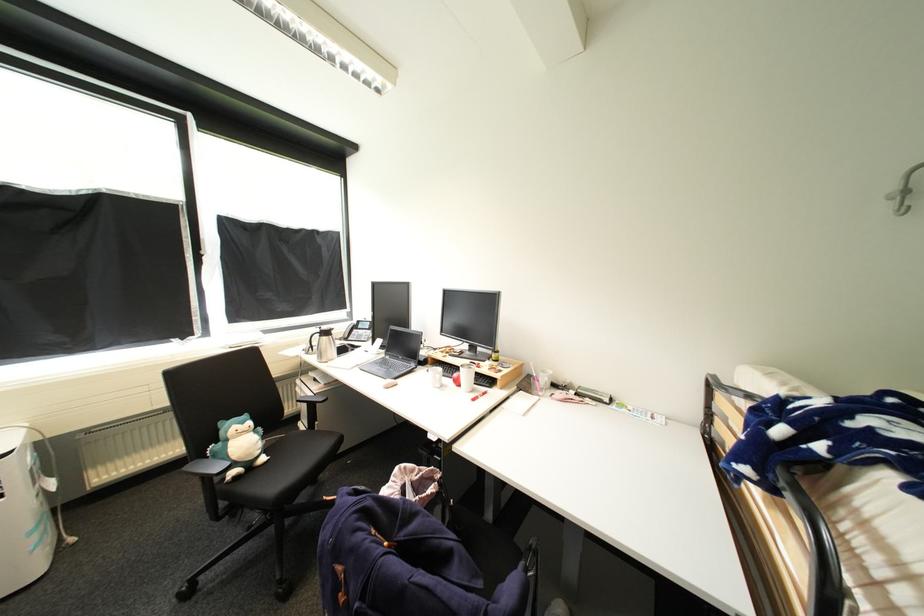
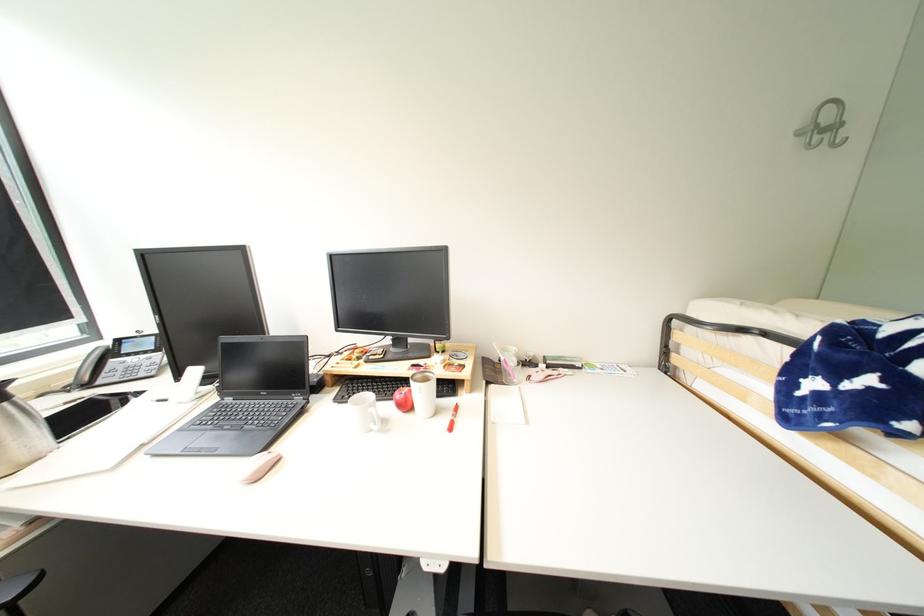
The point at (347, 338) is marked in the first image. Where is the corresponding point in the second image?

(75, 384)